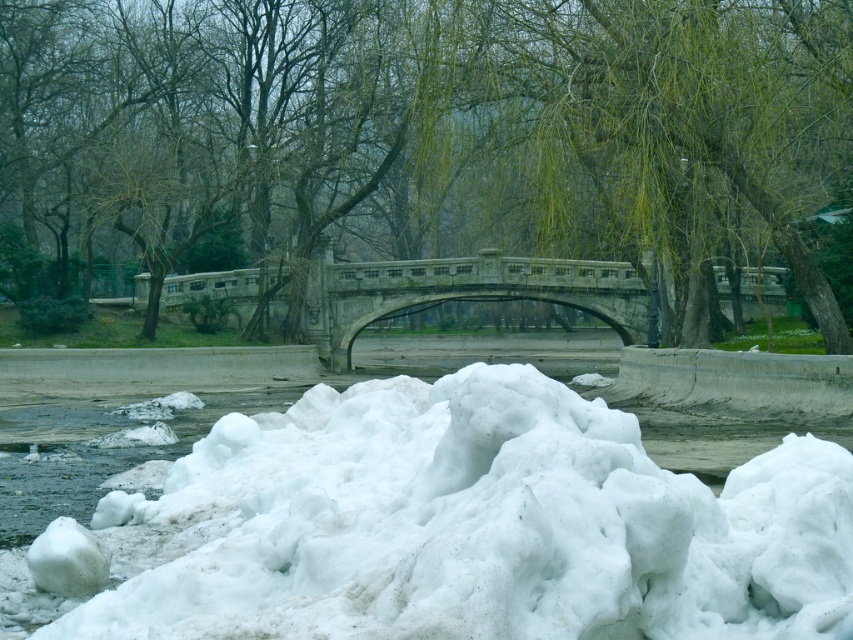
Which of these two, green leafy tree at center or white fluffy snow at center, stands shorter?

With less height is white fluffy snow at center.

Image resolution: width=853 pixels, height=640 pixels. What do you see at coordinates (427, 129) in the screenshot? I see `green leafy tree at center` at bounding box center [427, 129].

Locate an element on the screen. The width and height of the screenshot is (853, 640). green leafy tree at center is located at coordinates (427, 129).

Is point (659, 518) farther from camera compared to point (631, 332)?

No, (659, 518) is in front of (631, 332).

Between white fluffy snow at center and stone bridge at center, which one appears on the right side from the viewer's perspective?

From the viewer's perspective, white fluffy snow at center appears more on the right side.

Who is more forward, (576, 432) or (550, 280)?

Point (576, 432) is in front.

Find the location of a particular element. This screenshot has width=853, height=640. white fluffy snow at center is located at coordinates (465, 528).

Can you confirm if green leafy tree at center is taller than stone bridge at center?

Yes.

Locate an element on the screen. Image resolution: width=853 pixels, height=640 pixels. green leafy tree at center is located at coordinates (427, 129).

Identify the location of green leafy tree at center. This screenshot has width=853, height=640. (427, 129).